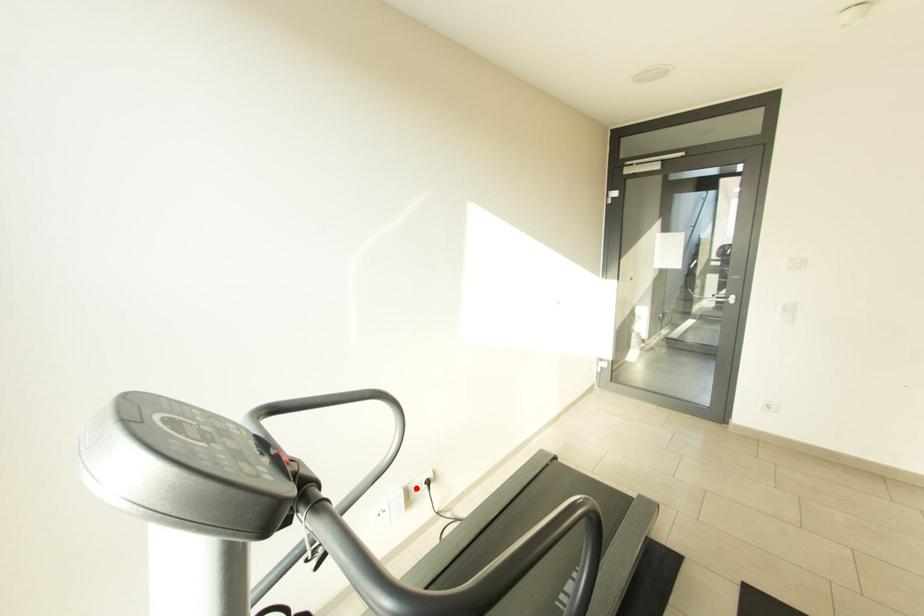
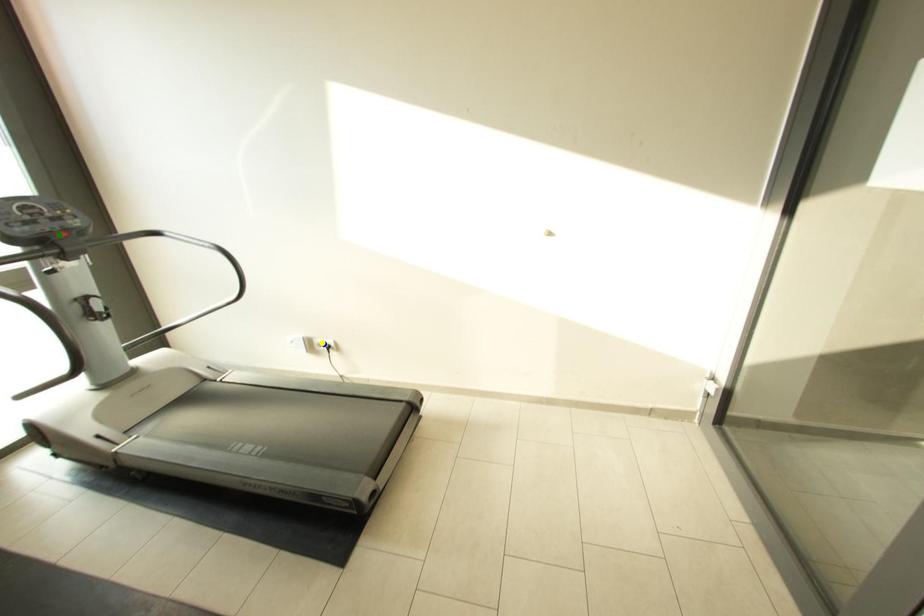
Question: I am providing you with two images of the same scene from different viewpoints. A red point is marked on the first image. You are given multiple points on the second image. Which point in image 2 is actually the same real-world point as the red point in image 1?

Choices:
 (A) blue point
 (B) green point
 (C) yellow point

Answer: (C)